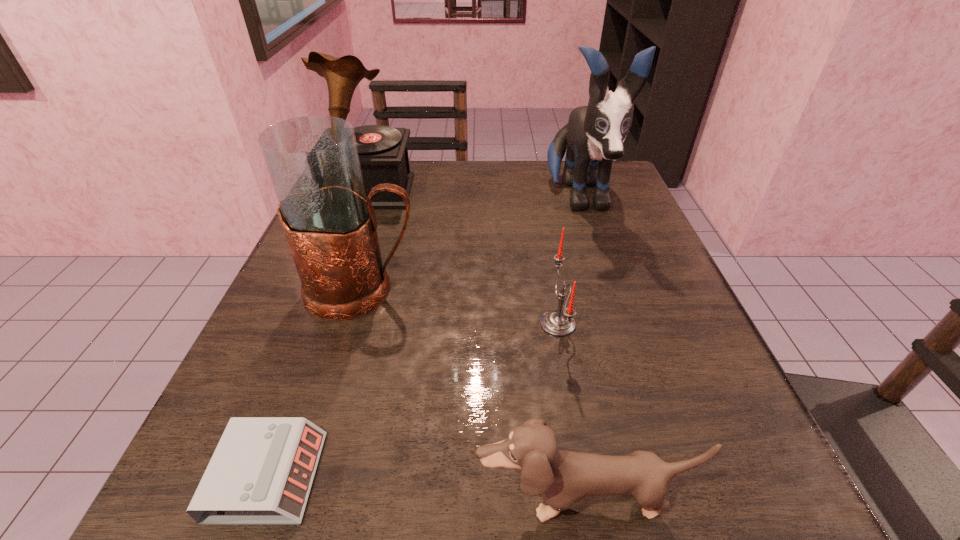
The image size is (960, 540). Find the location of `object that is at the far left corner`. object that is at the far left corner is located at coordinates (383, 153).

This screenshot has height=540, width=960. I want to click on object that is at the near left corner, so click(x=261, y=472).

Locate an element on the screen. The width and height of the screenshot is (960, 540). object at the far right corner is located at coordinates (594, 135).

Where is `object that is at the near right corner`? The image size is (960, 540). object that is at the near right corner is located at coordinates (561, 477).

Locate an element on the screen. vacant space at the far edge of the desktop is located at coordinates click(x=520, y=183).

Identify the location of vacant space at the near edge of the desktop. The height and width of the screenshot is (540, 960). (425, 523).

I want to click on vacant space at the left edge, so click(329, 376).

In the image, there is a desktop. Identify the location of vacant space at the right edge. (716, 360).

The height and width of the screenshot is (540, 960). What are the coordinates of `free space between the phonograph_record and the nearer puppy` in the screenshot? It's located at (475, 345).

The width and height of the screenshot is (960, 540). Find the location of `vacant space in between the taller puppy and the pitcher`. vacant space in between the taller puppy and the pitcher is located at coordinates (470, 244).